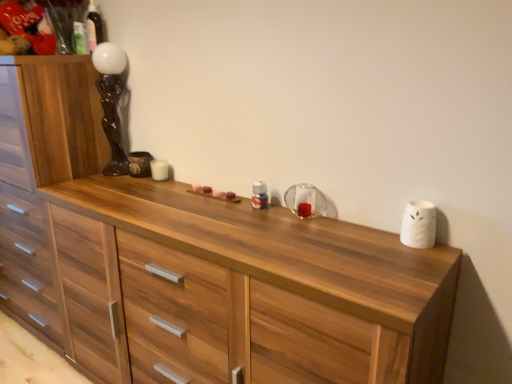
At what (x,y) coordinates should I click in order to perform the action: click on free spot in front of black glossy statue at upper left. Please return your answer as a coordinate pair (x, y). This screenshot has width=512, height=384. Looking at the image, I should click on (99, 185).